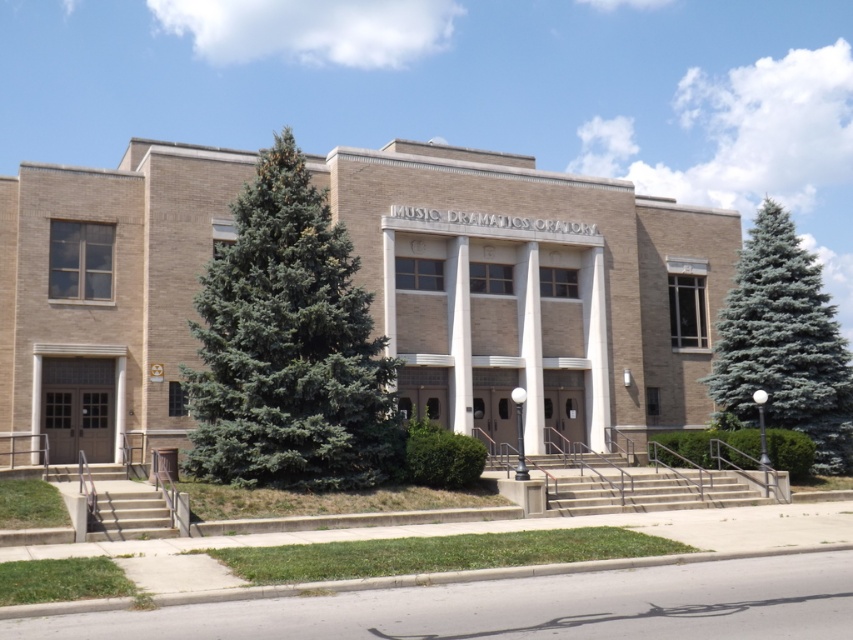
In the scene shown: Which of these two, green needle-like at center or blue-green coniferous tree at right, stands taller?

blue-green coniferous tree at right

This screenshot has width=853, height=640. Find the location of `green needle-like at center`. green needle-like at center is located at coordinates (288, 348).

The height and width of the screenshot is (640, 853). Describe the element at coordinates (288, 348) in the screenshot. I see `green needle-like at center` at that location.

I want to click on green needle-like at center, so click(x=288, y=348).